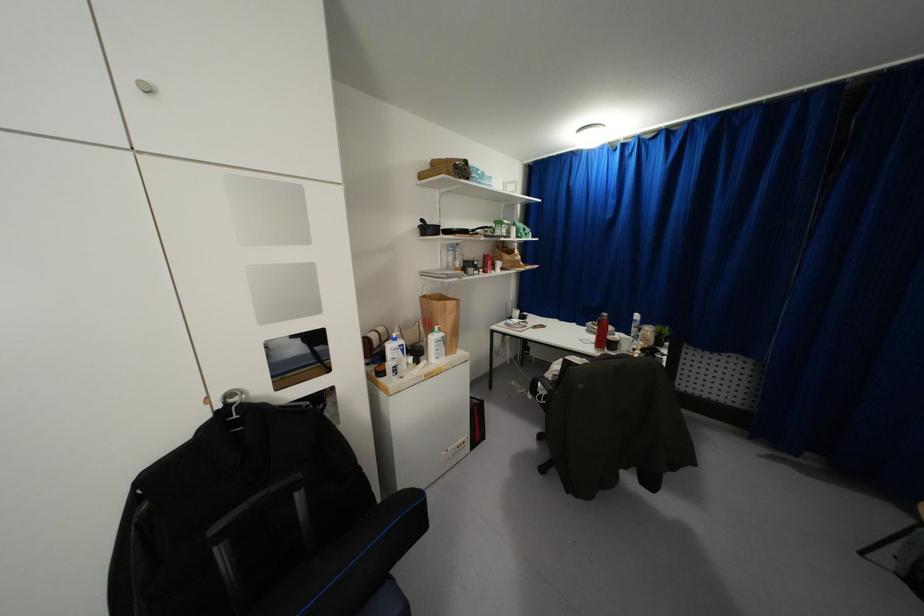
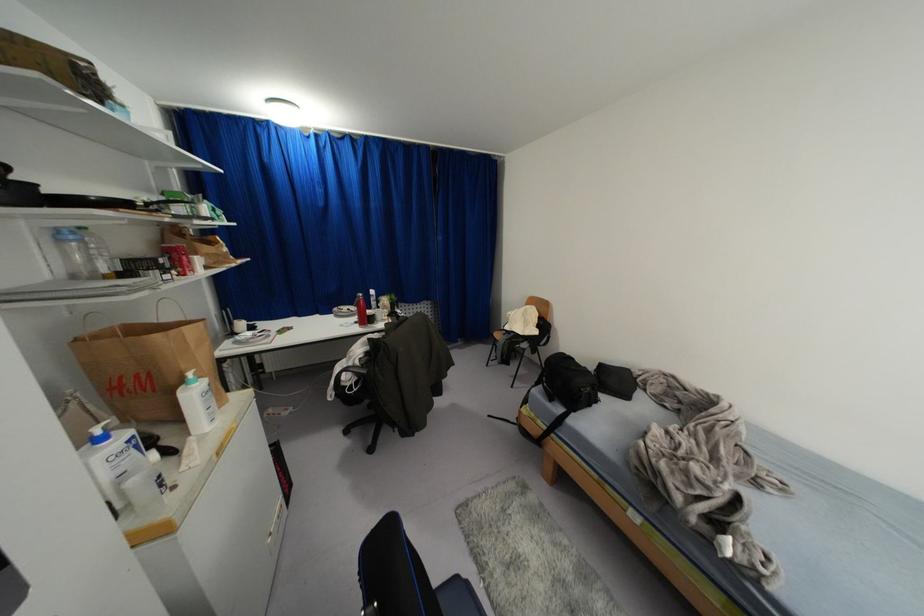
Locate, in the second image, the point that corresponds to (x=446, y=249) in the first image.

(62, 240)